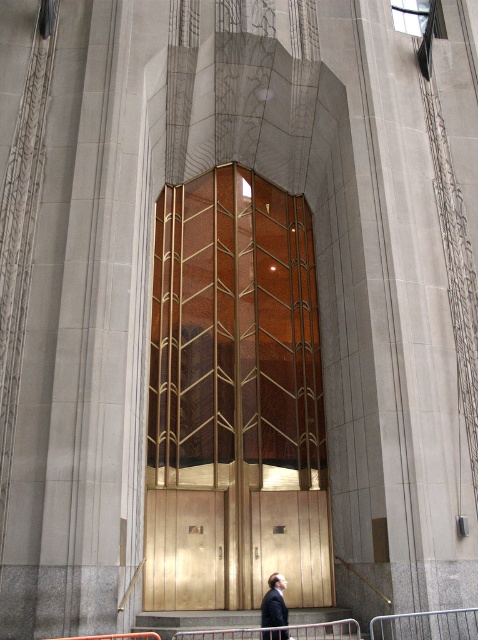
Question: From the image, what is the correct spatial relationship of gold textured elevator at center in relation to dark suit at center?

Choices:
 (A) below
 (B) above

Answer: (B)

Question: Which point is closer to the camera taking this photo?

Choices:
 (A) (206, 637)
 (B) (271, 589)

Answer: (B)

Question: Is gold metallic stair at center above dark suit at center?

Choices:
 (A) yes
 (B) no

Answer: (B)

Question: Which object is farther from the camera taking this photo?

Choices:
 (A) gold metallic stair at center
 (B) dark suit at center

Answer: (A)

Question: Is gold textured elevator at center behind gold metallic stair at center?

Choices:
 (A) yes
 (B) no

Answer: (A)

Question: Among these points, which one is nearest to the camera?

Choices:
 (A) click(x=184, y=628)
 (B) click(x=271, y=584)
 (C) click(x=303, y=538)

Answer: (B)